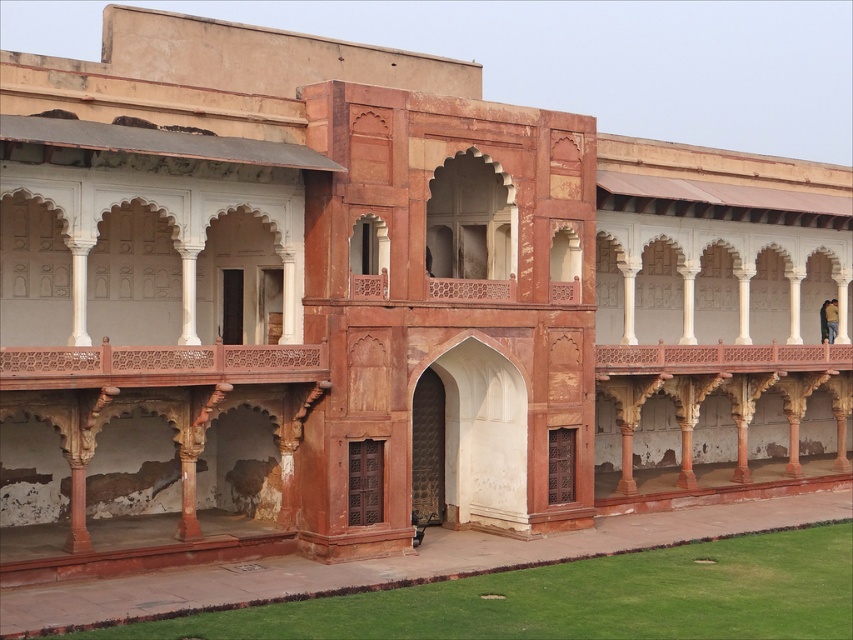
Question: Which of the following is the farthest from the observer?

Choices:
 (A) (172, 371)
 (B) (653, 344)

Answer: (B)

Question: Is carved wood balcony at center further to the viewer compared to rustic wood balcony at upper center?

Choices:
 (A) yes
 (B) no

Answer: (B)

Question: Can you confirm if carved wood balcony at center is positioned to the right of rustic wood balcony at upper center?

Choices:
 (A) yes
 (B) no

Answer: (B)

Question: Does carved wood balcony at center have a smaller size compared to rustic wood balcony at upper center?

Choices:
 (A) yes
 (B) no

Answer: (A)